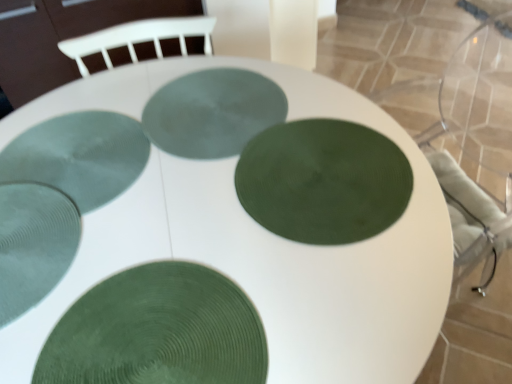
This screenshot has width=512, height=384. Identify the location of free space in front of green textured glass plate at center, which ranks as the third glass plate in front-to-back order. (315, 307).